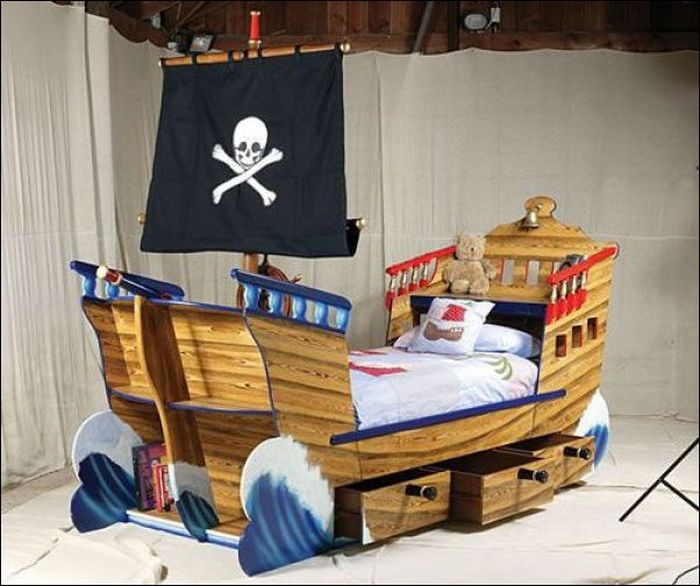
The width and height of the screenshot is (700, 586). Identify the location of drawer. (395, 500), (505, 493), (561, 463).